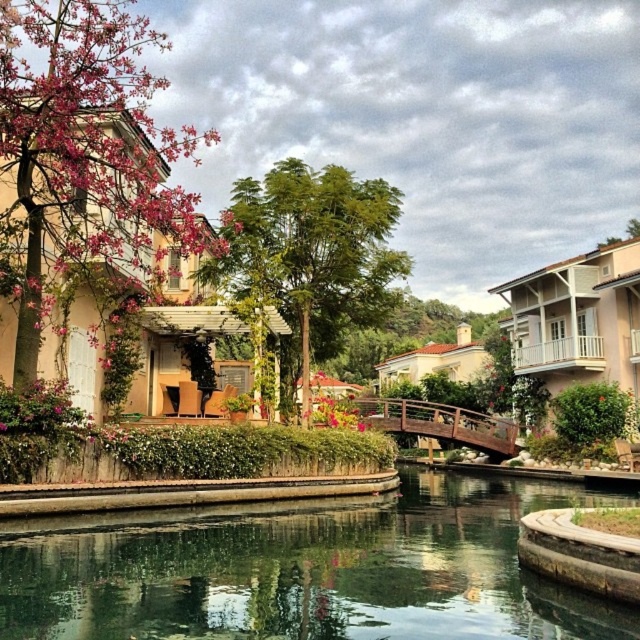
Is point (451, 608) less distant than point (372, 244)?

Yes, point (451, 608) is in front of point (372, 244).

Who is more forward, (442, 632) or (301, 166)?

Point (442, 632) is in front.

The image size is (640, 640). I want to click on clear glass water at center, so click(305, 570).

Is pink blossoms at left positioned before green leafy tree at center?

Yes, pink blossoms at left is closer to the viewer.

Is point (96, 124) farther from viewer compared to point (275, 284)?

No, (96, 124) is closer to viewer.

The image size is (640, 640). I want to click on pink blossoms at left, so 84,148.

Is clear glass water at center smaller than pink blossoms at left?

Indeed, clear glass water at center has a smaller size compared to pink blossoms at left.

Is clear glass water at center to the left of pink blossoms at left from the viewer's perspective?

Incorrect, clear glass water at center is not on the left side of pink blossoms at left.

The width and height of the screenshot is (640, 640). Find the location of `clear glass water at center`. clear glass water at center is located at coordinates point(305,570).